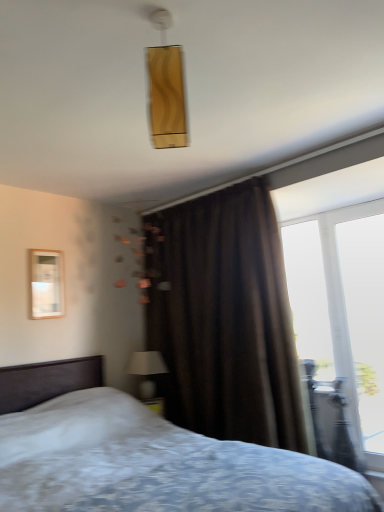
Where is `empty space that is ontop of gold textured rectangular light fixture at upper center (from a real-world perspective)`? The width and height of the screenshot is (384, 512). empty space that is ontop of gold textured rectangular light fixture at upper center (from a real-world perspective) is located at coordinates (158, 16).